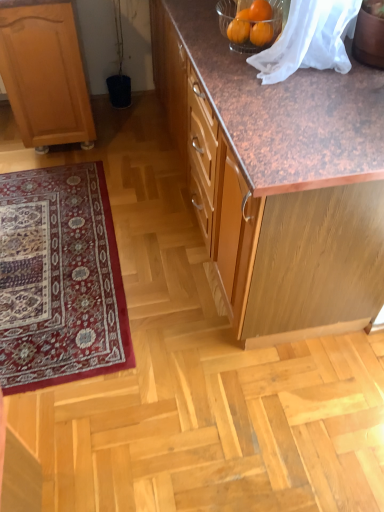
Question: Is the surface of brown wood cabinet at center, the 1th cabinetry positioned from the right, in direct contact with carpeted rug at lower left?

Choices:
 (A) no
 (B) yes

Answer: (A)

Question: Considering the relative positions of brown wood cabinet at center, which is counted as the 2th cabinetry, starting from the left, and carpeted rug at lower left in the image provided, is brown wood cabinet at center, which is counted as the 2th cabinetry, starting from the left, to the right of carpeted rug at lower left from the viewer's perspective?

Choices:
 (A) no
 (B) yes

Answer: (B)

Question: Does brown wood cabinet at center, which is counted as the 2th cabinetry, starting from the left, have a lesser width compared to carpeted rug at lower left?

Choices:
 (A) no
 (B) yes

Answer: (B)

Question: Would you say brown wood cabinet at center, the 1th cabinetry positioned from the right, is outside carpeted rug at lower left?

Choices:
 (A) yes
 (B) no

Answer: (A)

Question: Is carpeted rug at lower left at the back of brown wood cabinet at center, which is counted as the 2th cabinetry, starting from the left?

Choices:
 (A) yes
 (B) no

Answer: (B)

Question: From a real-world perspective, is brown wood cabinet at center, which is counted as the 2th cabinetry, starting from the left, below carpeted rug at lower left?

Choices:
 (A) no
 (B) yes

Answer: (A)

Question: Considering the relative sizes of carpeted rug at lower left and orange matte at upper center, acting as the second orange starting from the top, in the image provided, is carpeted rug at lower left wider than orange matte at upper center, acting as the second orange starting from the top,?

Choices:
 (A) yes
 (B) no

Answer: (A)

Question: Can you confirm if carpeted rug at lower left is thinner than orange matte at upper center, placed as the first orange when sorted from bottom to top?

Choices:
 (A) yes
 (B) no

Answer: (B)

Question: Is carpeted rug at lower left turned away from orange matte at upper center, acting as the second orange starting from the top?

Choices:
 (A) no
 (B) yes

Answer: (A)

Question: Can we say carpeted rug at lower left lies outside orange matte at upper center, acting as the second orange starting from the top?

Choices:
 (A) yes
 (B) no

Answer: (A)

Question: Is carpeted rug at lower left in contact with orange matte at upper center, acting as the second orange starting from the top?

Choices:
 (A) no
 (B) yes

Answer: (A)

Question: From a real-world perspective, is carpeted rug at lower left under orange matte at upper center, acting as the second orange starting from the top?

Choices:
 (A) yes
 (B) no

Answer: (A)

Question: Is carpeted rug at lower left bigger than brown wood cabinet at center, the 1th cabinetry positioned from the right?

Choices:
 (A) no
 (B) yes

Answer: (A)